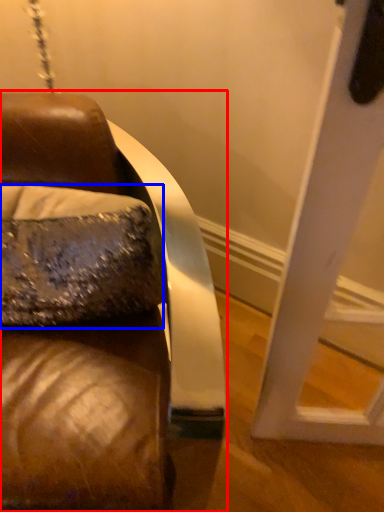
Question: Which of the following is the closest to the observer, furniture (highlighted by a red box) or throw pillow (highlighted by a blue box)?

Choices:
 (A) furniture
 (B) throw pillow

Answer: (A)